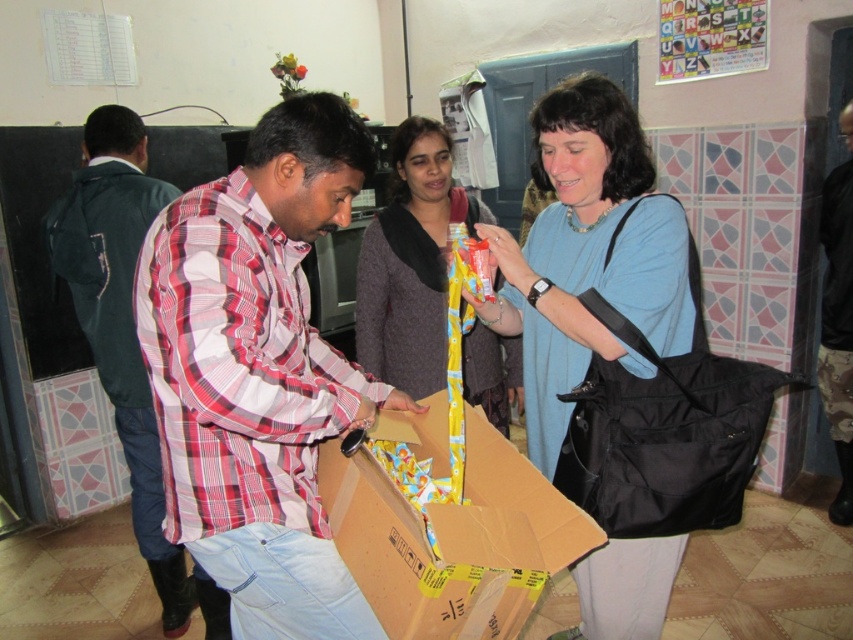
Question: Which of the following is the closest to the observer?

Choices:
 (A) cardboard box at center
 (B) plaid shirt at left
 (C) matte yellow scarf at center
 (D) camouflage pants at lower right

Answer: (A)

Question: Observing the image, what is the correct spatial positioning of cardboard box at center in reference to camouflage pants at lower right?

Choices:
 (A) above
 (B) below

Answer: (B)

Question: Which object is the farthest from the plaid shirt at left?

Choices:
 (A) camouflage pants at lower right
 (B) plaid shirt at center

Answer: (A)

Question: Can you confirm if plaid shirt at center is positioned above matte yellow scarf at center?

Choices:
 (A) no
 (B) yes

Answer: (A)

Question: Estimate the real-world distances between objects in this image. Which object is farther from the plaid shirt at left?

Choices:
 (A) plaid shirt at center
 (B) cardboard box at center

Answer: (B)

Question: Does blue fabric dress at center have a larger size compared to camouflage pants at lower right?

Choices:
 (A) no
 (B) yes

Answer: (B)